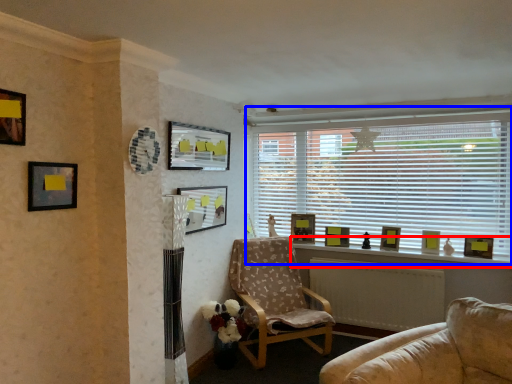
Question: Which object is further to the camera taking this photo, window sill (highlighted by a red box) or window (highlighted by a blue box)?

Choices:
 (A) window sill
 (B) window

Answer: (B)